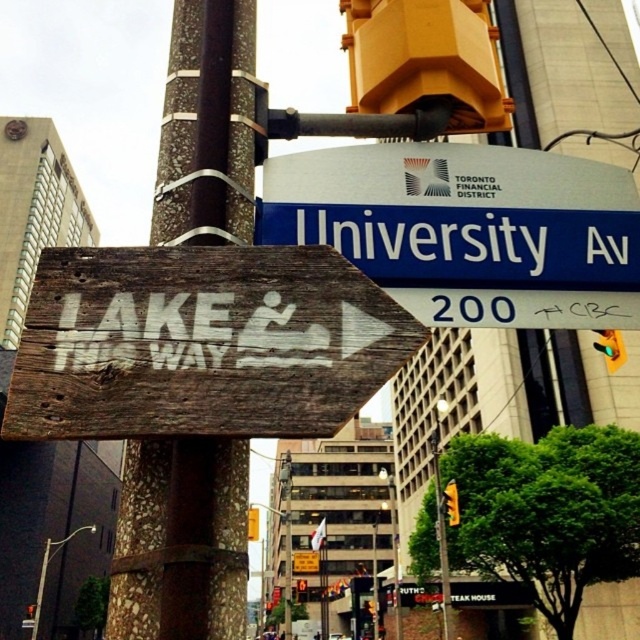
Question: Which of the following is the farthest from the observer?

Choices:
 (A) blue plastic street sign at upper center
 (B) brown textured pole at center

Answer: (A)

Question: Is brown textured pole at center bigger than blue plastic street sign at upper center?

Choices:
 (A) no
 (B) yes

Answer: (B)

Question: Does brown textured pole at center appear on the right side of blue plastic street sign at upper center?

Choices:
 (A) yes
 (B) no

Answer: (B)

Question: Can you confirm if brown textured pole at center is wider than blue plastic street sign at upper center?

Choices:
 (A) no
 (B) yes

Answer: (A)